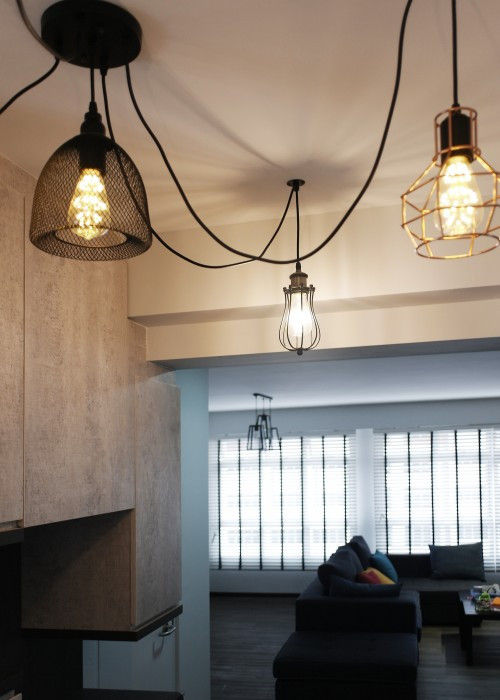
What are the coordinates of `yellow lightbulb` in the screenshot? It's located at (86, 234), (467, 220).